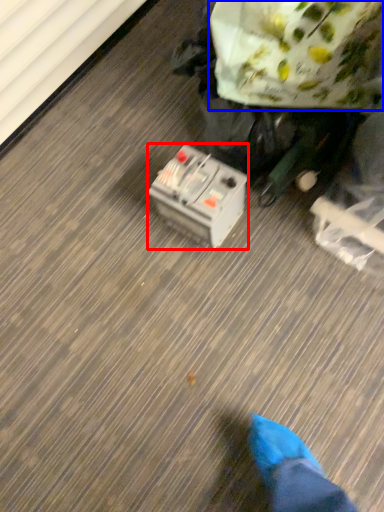
Question: Which of the following is the farthest to the observer, equipment (highlighted by a red box) or paper bag (highlighted by a blue box)?

Choices:
 (A) equipment
 (B) paper bag

Answer: (A)